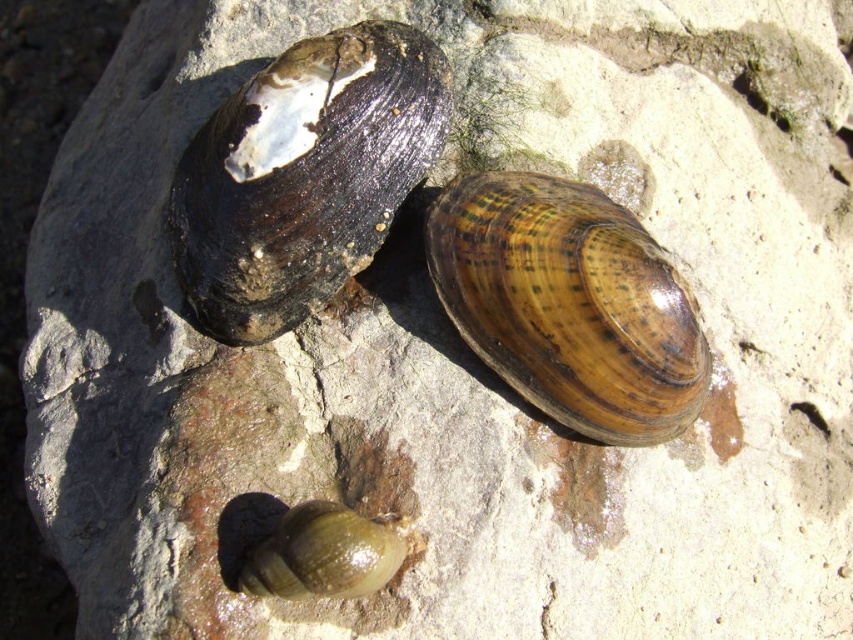
You are an archaeologist examining the shells on the rock. You need to determine which shell is wider between the shiny black shell at upper left and the brown textured shell at center. Which one is wider?

The shiny black shell at upper left is wider than the brown textured shell at center according to the description.

You are an artist trying to draw the shells in the image. You need to know which object is taller to scale them correctly. Which one is taller between the brown textured shell at center and the green glossy snail at lower center?

The brown textured shell at center is taller than the green glossy snail at lower center according to the description.

You are an artist trying to paint the shells in the image. You need to know which shell is larger to scale them correctly. Which one is bigger between the brown textured shell at center and the green glossy snail at lower center?

The brown textured shell at center is bigger than the green glossy snail at lower center.